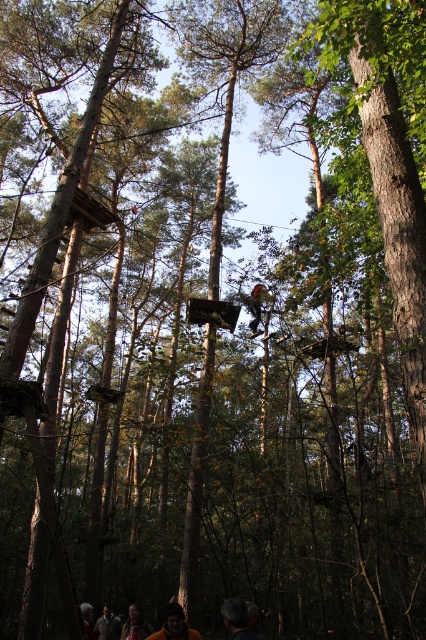
Question: Where is dark brown hair at lower center located in relation to dark brown leather jacket at lower center in the image?

Choices:
 (A) above
 (B) below

Answer: (A)

Question: Estimate the real-world distances between objects in this image. Which object is farther from the dark brown hair at lower center?

Choices:
 (A) orange fabric jacket at lower center
 (B) brown leather jacket at lower center
 (C) dark brown leather jacket at lower center

Answer: (C)

Question: Which of the following is the closest to the observer?

Choices:
 (A) (108, 621)
 (B) (170, 612)
 (C) (138, 618)

Answer: (B)

Question: Which of these objects is positioned closest to the dark brown leather jacket at lower center?

Choices:
 (A) dark brown hair at lower center
 (B) brown leather jacket at lower center
 (C) orange fabric jacket at lower center

Answer: (C)

Question: Is brown leather jacket at lower center thinner than dark brown leather jacket at lower center?

Choices:
 (A) no
 (B) yes

Answer: (B)

Question: Can you confirm if dark brown hair at lower center is thinner than brown leather jacket at lower center?

Choices:
 (A) yes
 (B) no

Answer: (A)